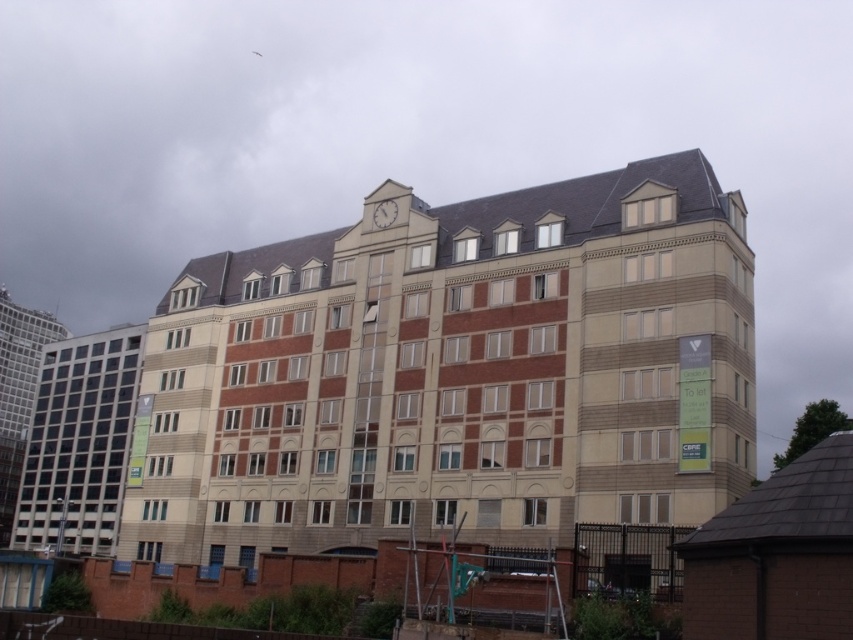
Question: Which is nearer to the brown brick building at lower right?

Choices:
 (A) matte glass building at left
 (B) white stone clock at upper center
 (C) beige brick building at center

Answer: (C)

Question: Which object is positioned farthest from the white stone clock at upper center?

Choices:
 (A) matte glass building at left
 (B) brown brick building at lower right
 (C) beige brick building at center

Answer: (A)

Question: Observing the image, what is the correct spatial positioning of matte glass building at left in reference to white stone clock at upper center?

Choices:
 (A) left
 (B) right

Answer: (A)

Question: Considering the relative positions of brown brick building at lower right and white stone clock at upper center in the image provided, where is brown brick building at lower right located with respect to white stone clock at upper center?

Choices:
 (A) below
 (B) above

Answer: (A)

Question: Which object is positioned closest to the brown brick building at lower right?

Choices:
 (A) matte glass building at left
 (B) beige brick building at center
 (C) white stone clock at upper center

Answer: (B)

Question: Can you confirm if beige brick building at center is wider than matte glass building at left?

Choices:
 (A) no
 (B) yes

Answer: (B)